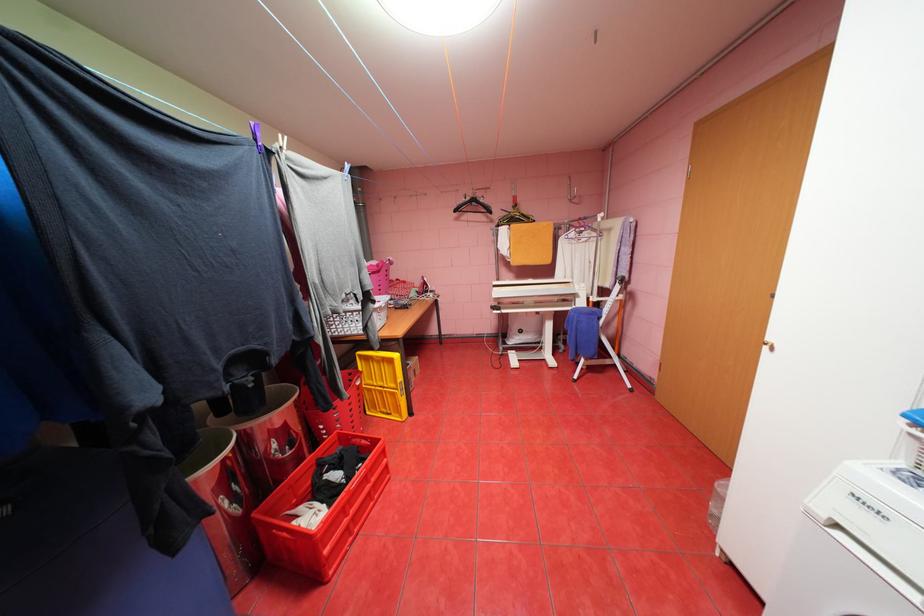
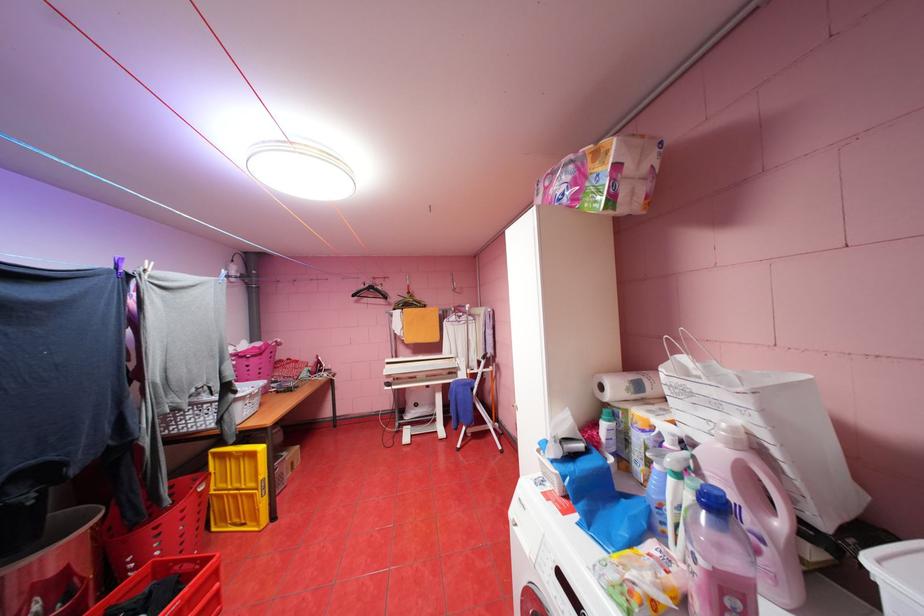
Where in the second image is the point corresponding to (504,310) from the first image?

(395, 387)